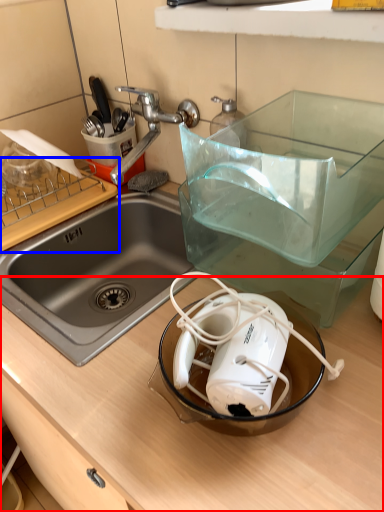
Question: Which point is further to the camera, counter top (highlighted by a red box) or cutting board (highlighted by a blue box)?

Choices:
 (A) counter top
 (B) cutting board

Answer: (B)